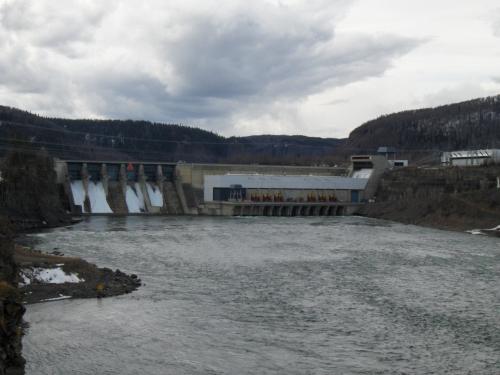
The image size is (500, 375). I want to click on vent hole, so click(x=362, y=157).